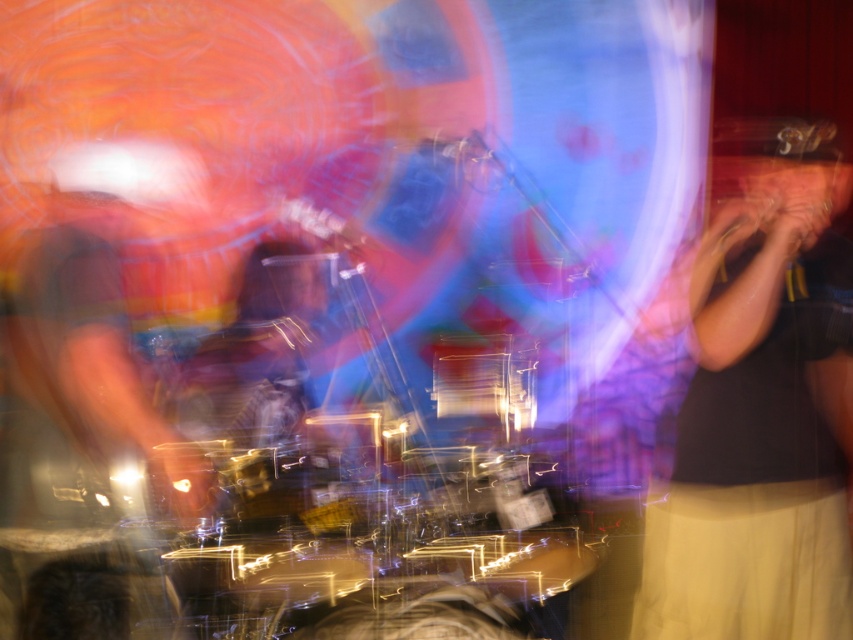
Is point (698, 538) more distant than point (463, 365)?

No, (698, 538) is closer to viewer.

Does black fabric shirt at right have a lesser height compared to clear plastic drum at center?

In fact, black fabric shirt at right may be taller than clear plastic drum at center.

Does point (657, 563) lie behind point (525, 394)?

No, (657, 563) is in front of (525, 394).

At what (x,y) coordinates should I click in order to perform the action: click on black fabric shirt at right. Please return your answer as a coordinate pair (x, y). Looking at the image, I should click on (763, 413).